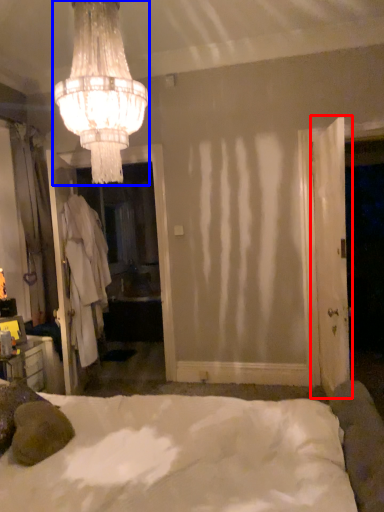
Question: Among these objects, which one is nearest to the camera, door (highlighted by a red box) or lamp (highlighted by a blue box)?

Choices:
 (A) door
 (B) lamp

Answer: (B)